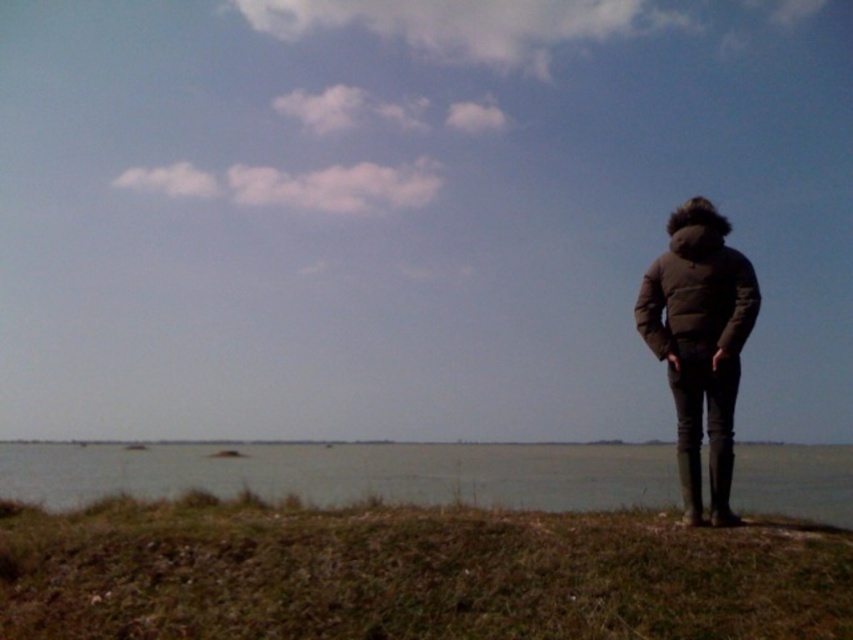
Question: Which point is farther to the camera?

Choices:
 (A) green grass at lower right
 (B) matte black jacket at right
 (C) gray matte water at lower center

Answer: (B)

Question: Based on their relative distances, which object is nearer to the matte black jacket at right?

Choices:
 (A) gray matte water at lower center
 (B) green grass at lower right

Answer: (B)

Question: Which of the following is the closest to the observer?

Choices:
 (A) green grass at lower right
 (B) matte black jacket at right

Answer: (A)

Question: Is green grass at lower right in front of matte black jacket at right?

Choices:
 (A) no
 (B) yes

Answer: (B)

Question: Can you confirm if gray matte water at lower center is positioned to the left of matte black jacket at right?

Choices:
 (A) no
 (B) yes

Answer: (B)

Question: Does green grass at lower right appear under matte black jacket at right?

Choices:
 (A) no
 (B) yes

Answer: (B)